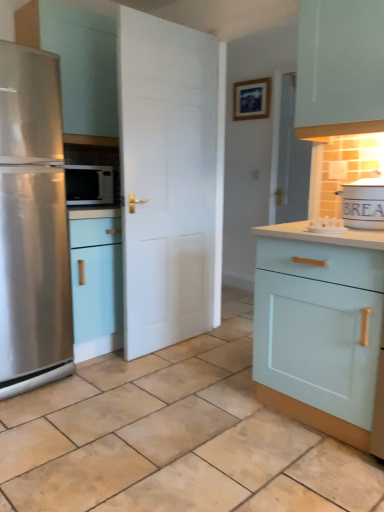
Where is `vacant area that lies to the right of stainless steel refrigerator at left`? This screenshot has height=512, width=384. vacant area that lies to the right of stainless steel refrigerator at left is located at coordinates (104, 385).